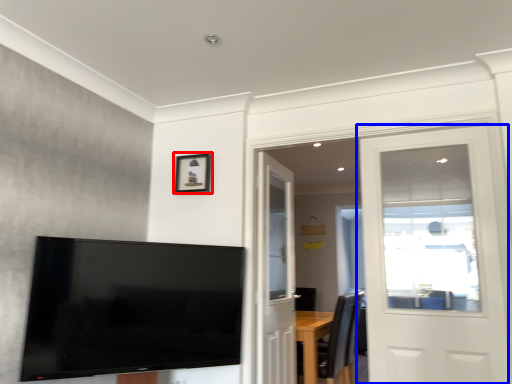
Question: Which point is further to the camera, picture frame (highlighted by a red box) or door (highlighted by a blue box)?

Choices:
 (A) picture frame
 (B) door

Answer: (A)